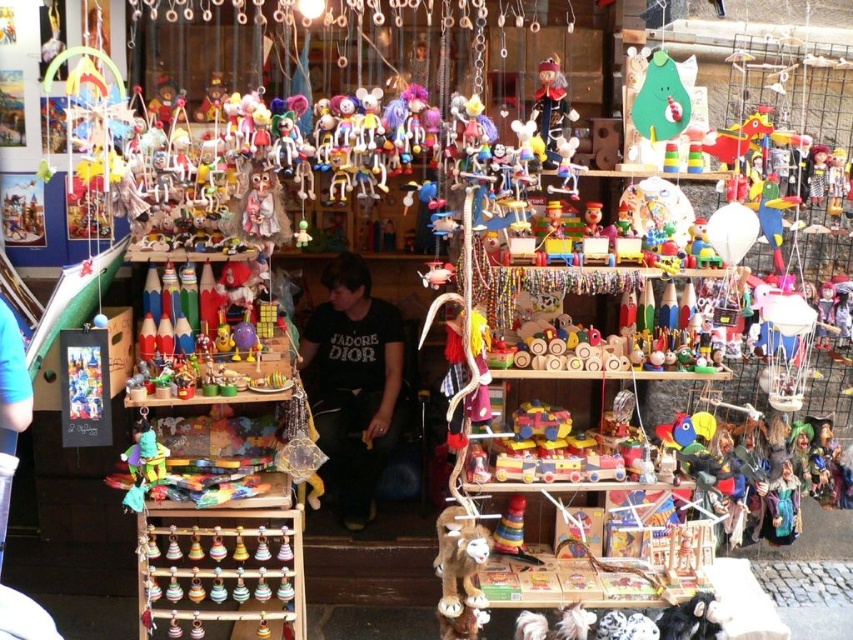
This screenshot has width=853, height=640. What do you see at coordinates (352, 384) in the screenshot?
I see `black cotton shirt at center` at bounding box center [352, 384].

Image resolution: width=853 pixels, height=640 pixels. Describe the element at coordinates (352, 384) in the screenshot. I see `black cotton shirt at center` at that location.

This screenshot has height=640, width=853. What are the coordinates of `black cotton shirt at center` in the screenshot? It's located at (352, 384).